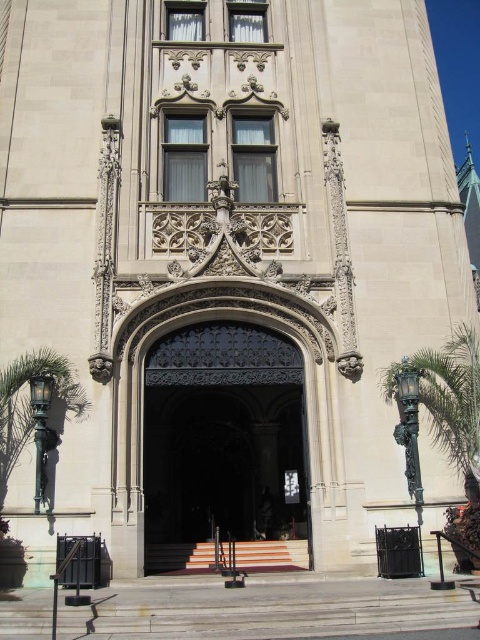
Question: Can you confirm if dark wrought iron gate at center is wider than orange carpeted stairs at center?

Choices:
 (A) yes
 (B) no

Answer: (A)

Question: In this image, where is dark wrought iron gate at center located relative to green leafy palm tree at right?

Choices:
 (A) right
 (B) left

Answer: (B)

Question: Which of the following is the closest to the observer?

Choices:
 (A) (387, 384)
 (B) (294, 552)
 (C) (24, 433)

Answer: (C)

Question: Which of the following is the closest to the observer?

Choices:
 (A) (474, 452)
 (B) (177, 561)
 (C) (256, 394)
 (D) (36, 420)

Answer: (D)

Question: Estimate the real-world distances between objects in this image. Which object is farther from the green leafy palm tree at lower left?

Choices:
 (A) dark wrought iron gate at center
 (B) orange carpeted stairs at center
 (C) green leafy palm tree at right

Answer: (C)

Question: Can you confirm if green leafy palm tree at right is positioned above orange carpeted stairs at center?

Choices:
 (A) no
 (B) yes

Answer: (B)